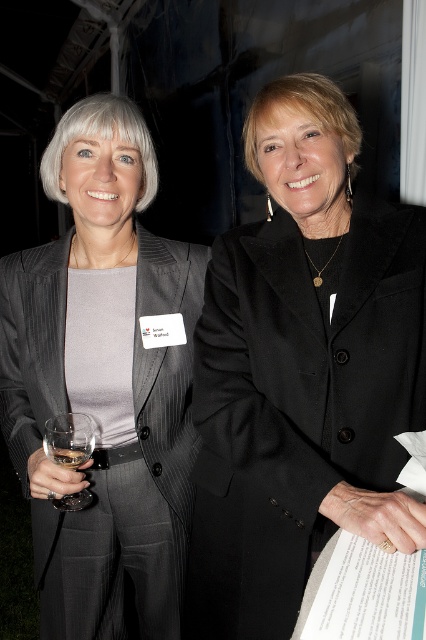
You are at a formal event and want to take a photo of the two women standing near you. You notice two points marked in the scene. One is at coordinates point (250, 317) and the other is at point (83, 456). Which point is closer to your camera lens if you are positioned to capture both points in the same frame?

Point (250, 317) is closer to your camera lens because it is further to the viewer than point (83, 456).

You are a photographer at a formal event, and you need to capture a photo of the clear glass wine at lower left and the black woolen blazer at right. Based on their positions, which object should you focus on first if you want to ensure both are in the frame without moving the camera?

The black woolen blazer at right is to the right of the clear glass wine at lower left, so you should focus on the clear glass wine at lower left first to ensure both are within the frame.

You are a photographer at the event and want to capture both the black woolen blazer at right and the clear glass wine at lower left in the same frame. Since you need to ensure they are both visible, which object should you focus on first to account for their sizes?

The black woolen blazer at right is taller than the clear glass wine at lower left, so you should focus on the black woolen blazer at right first to ensure its full height is captured properly before adjusting for the smaller clear glass wine at lower left.